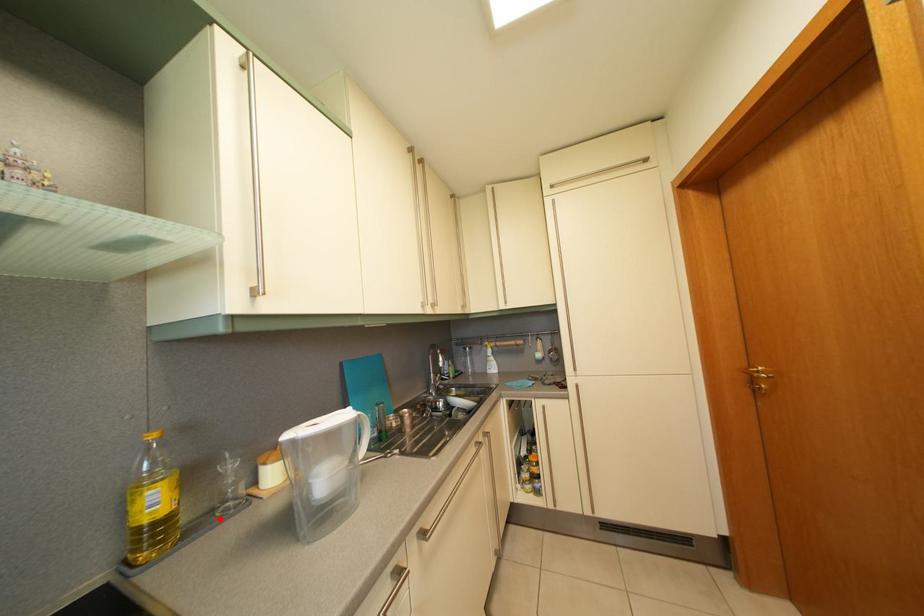
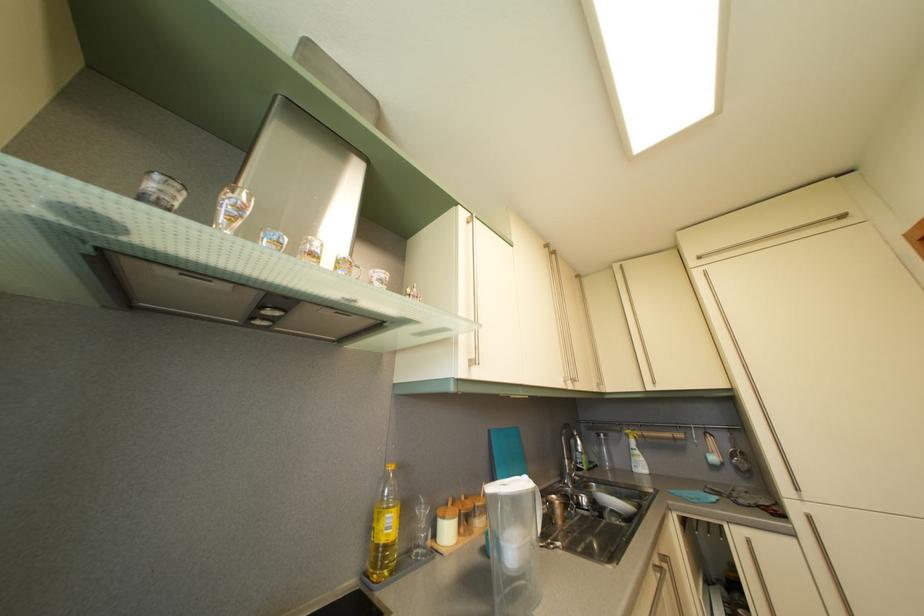
The point at the highlighted location is marked in the first image. Where is the corresponding point in the second image?

(417, 560)